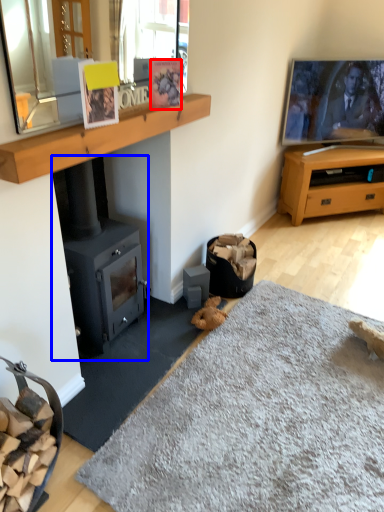
Question: Among these objects, which one is farthest to the camera, picture frame (highlighted by a red box) or wood burning stove (highlighted by a blue box)?

Choices:
 (A) picture frame
 (B) wood burning stove

Answer: (A)